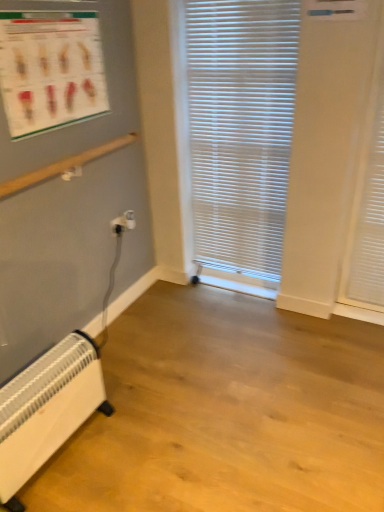
Question: Would you say matte plastic poster at upper left contains white matte shutter at right?

Choices:
 (A) yes
 (B) no

Answer: (B)

Question: Is matte plastic poster at upper left wider than white matte shutter at right?

Choices:
 (A) no
 (B) yes

Answer: (A)

Question: Does matte plastic poster at upper left have a lesser width compared to white matte shutter at right?

Choices:
 (A) yes
 (B) no

Answer: (A)

Question: Can you confirm if matte plastic poster at upper left is positioned to the right of white matte shutter at right?

Choices:
 (A) no
 (B) yes

Answer: (A)

Question: Is the surface of matte plastic poster at upper left in direct contact with white matte shutter at right?

Choices:
 (A) yes
 (B) no

Answer: (B)

Question: Is white plastic heater at lower left in front of or behind white matte shutter at right in the image?

Choices:
 (A) front
 (B) behind

Answer: (A)

Question: Visually, is white plastic heater at lower left positioned to the left or to the right of white matte shutter at right?

Choices:
 (A) left
 (B) right

Answer: (A)

Question: Is white plastic heater at lower left wider or thinner than white matte shutter at right?

Choices:
 (A) thin
 (B) wide

Answer: (B)

Question: From a real-world perspective, is white plastic heater at lower left positioned above or below white matte shutter at right?

Choices:
 (A) above
 (B) below

Answer: (B)

Question: Is white matte shutter at right bigger or smaller than white plastic blinds at center?

Choices:
 (A) big
 (B) small

Answer: (B)

Question: From the image's perspective, relative to white plastic blinds at center, is white matte shutter at right above or below?

Choices:
 (A) above
 (B) below

Answer: (B)

Question: In terms of height, does white matte shutter at right look taller or shorter compared to white plastic blinds at center?

Choices:
 (A) short
 (B) tall

Answer: (A)

Question: Is white matte shutter at right spatially inside white plastic blinds at center, or outside of it?

Choices:
 (A) inside
 (B) outside

Answer: (B)

Question: From the image's perspective, is white plastic electrical outlet at lower left positioned above or below white plastic heater at lower left?

Choices:
 (A) above
 (B) below

Answer: (A)

Question: Choose the correct answer: Is white plastic electrical outlet at lower left inside white plastic heater at lower left or outside it?

Choices:
 (A) inside
 (B) outside

Answer: (B)